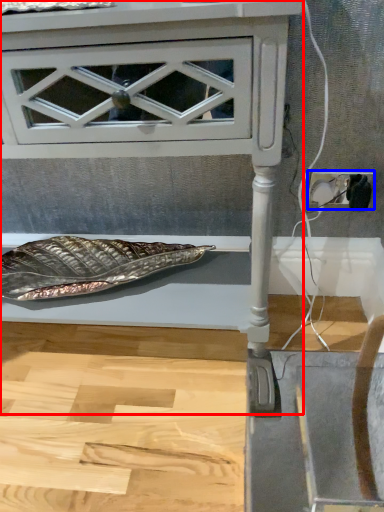
Question: Which of the following is the closest to the observer, furniture (highlighted by a red box) or electric outlet (highlighted by a blue box)?

Choices:
 (A) furniture
 (B) electric outlet

Answer: (A)